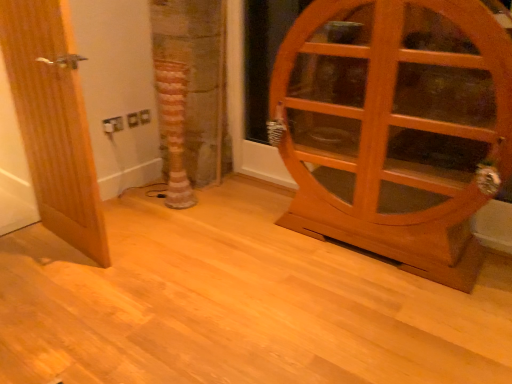
Locate an element on the screen. vacant area that lies between wooden cabinet at right, placed as the second door when sorted from left to right, and wooden door at left, which is counted as the 1th door, starting from the left is located at coordinates (231, 248).